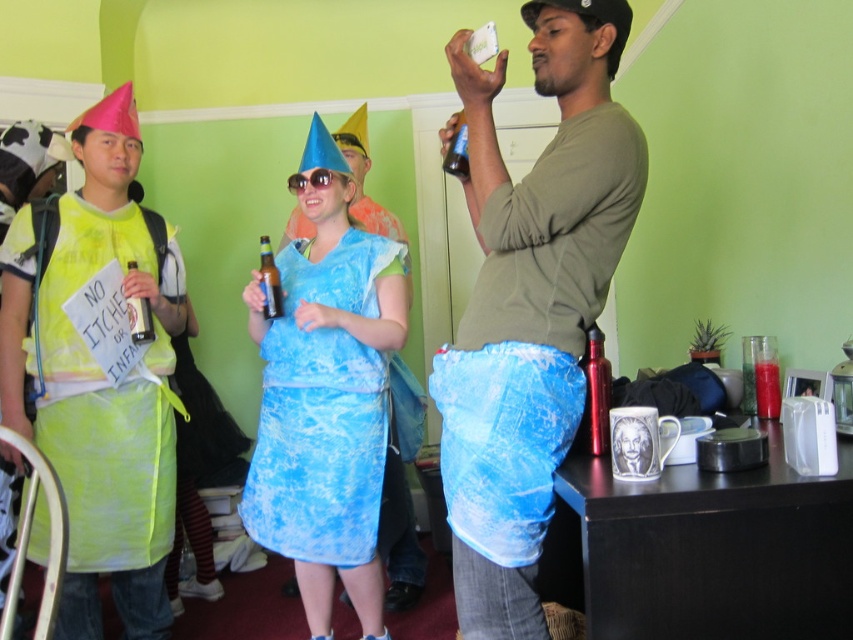
Consider the image. Measure the distance between yellow fabric apron at left and camera.

yellow fabric apron at left is 2.01 meters from camera.

Between yellow fabric apron at left and blue tie-dye dress at center, which one appears on the right side from the viewer's perspective?

From the viewer's perspective, blue tie-dye dress at center appears more on the right side.

The width and height of the screenshot is (853, 640). What do you see at coordinates (99, 378) in the screenshot?
I see `yellow fabric apron at left` at bounding box center [99, 378].

Find the location of `yellow fabric apron at left`. yellow fabric apron at left is located at coordinates (99, 378).

From the picture: Between blue denim shorts at center and yellow fabric apron at left, which one is positioned lower?

Positioned lower is yellow fabric apron at left.

Between point (527, 301) and point (30, 211), which one is positioned behind?

Positioned behind is point (30, 211).

In order to click on blue denim shorts at center in this screenshot , I will do `click(531, 305)`.

Is blue denim shorts at center thinner than blue tie-dye dress at center?

Yes, blue denim shorts at center is thinner than blue tie-dye dress at center.

Does blue denim shorts at center appear on the right side of blue tie-dye dress at center?

Yes, blue denim shorts at center is to the right of blue tie-dye dress at center.

Does point (532, 212) lie behind point (380, 244)?

No, (532, 212) is in front of (380, 244).

Image resolution: width=853 pixels, height=640 pixels. What are the coordinates of `blue denim shorts at center` in the screenshot? It's located at (531, 305).